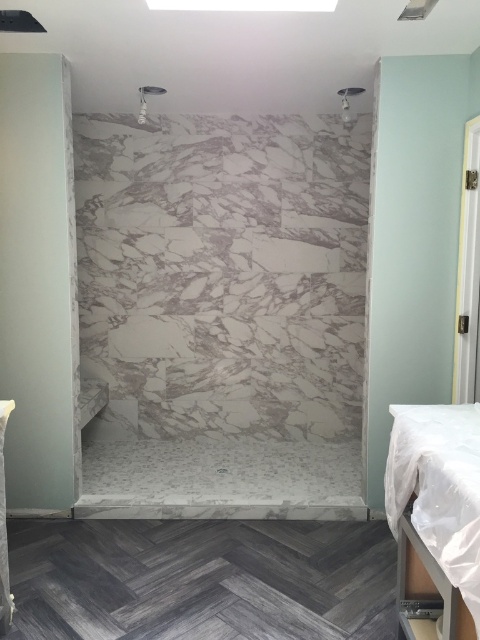
You are a delivery person who just arrived with a new bed. You need to place it in the bathroom but want to ensure there is enough space between it and the showerhead. According to the image, what is the minimum distance you should maintain between the white fabric bed at lower right and the matte white showerhead at upper center?

The minimum distance you should maintain between the white fabric bed at lower right and the matte white showerhead at upper center is at least 2.61 meters, as that is the current distance between them in the image.